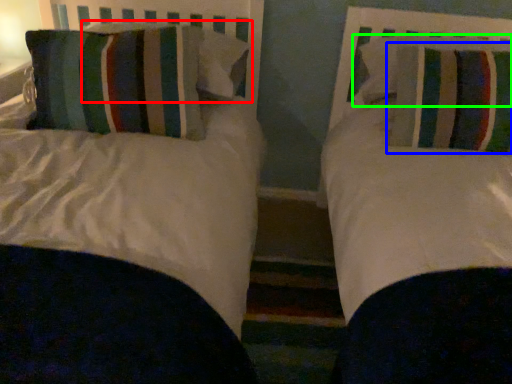
Question: Considering the real-world distances, which object is closest to pillow (highlighted by a red box)? pillow (highlighted by a blue box) or pillow (highlighted by a green box).

Choices:
 (A) pillow
 (B) pillow

Answer: (B)